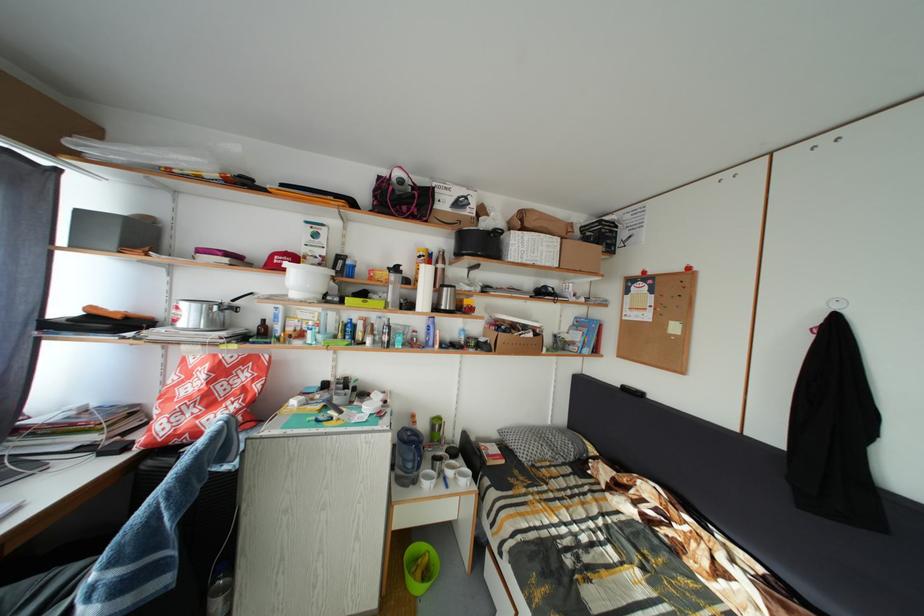
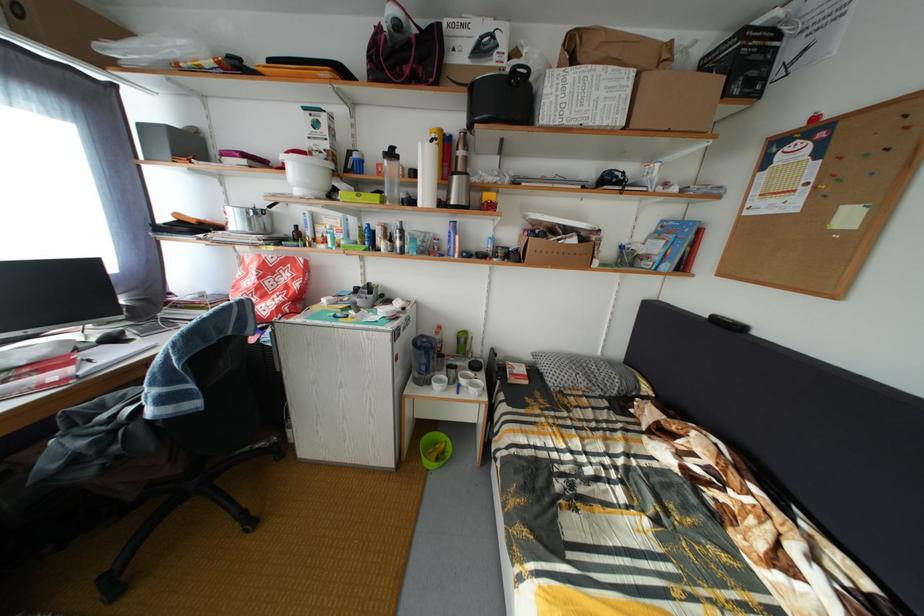
Find the pixel in the second image that matches pixel 423 488 in the first image.

(438, 390)